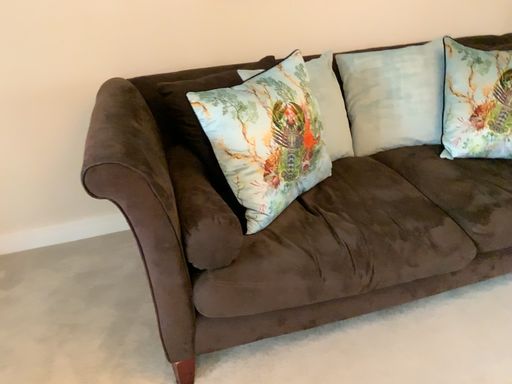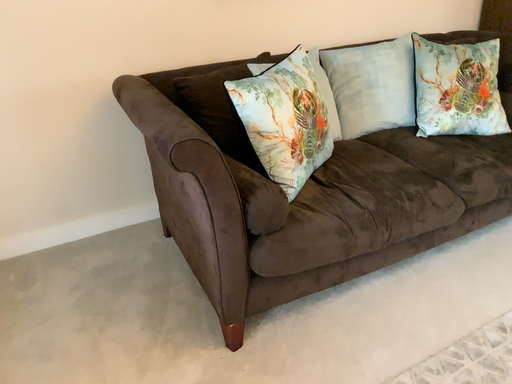
Question: How did the camera likely rotate when shooting the video?

Choices:
 (A) rotated left
 (B) rotated right

Answer: (B)